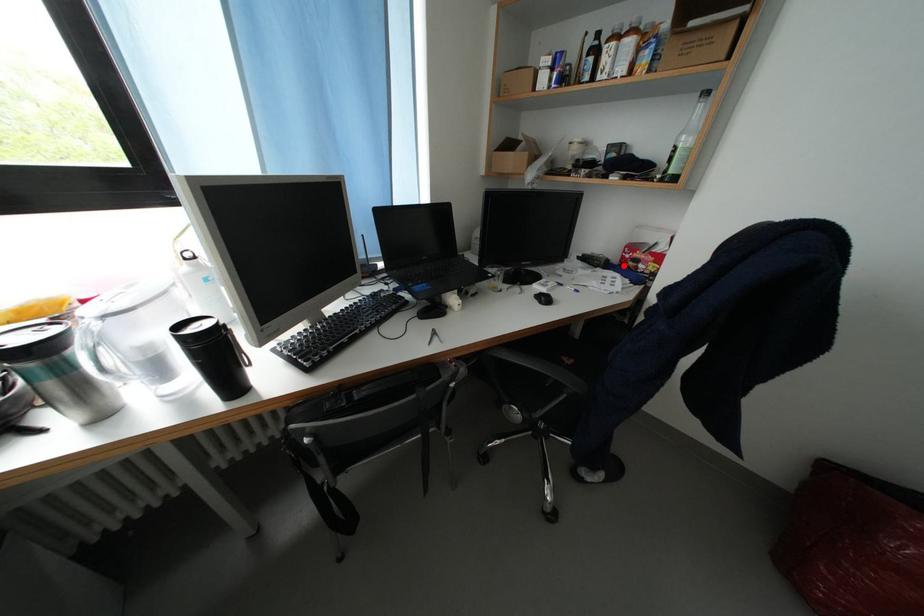
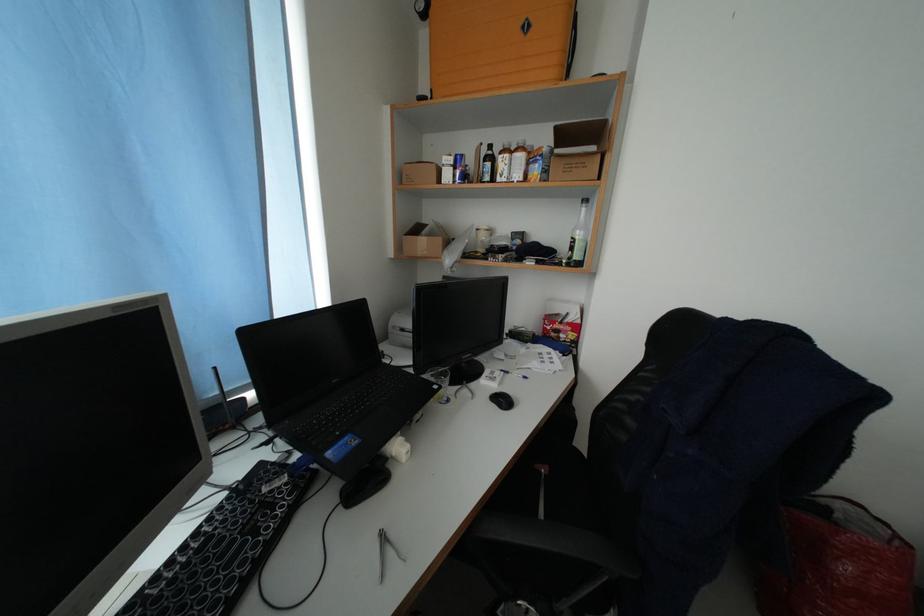
Locate, in the second image, the point that corresponds to the highlighted location in the first image.

(546, 338)